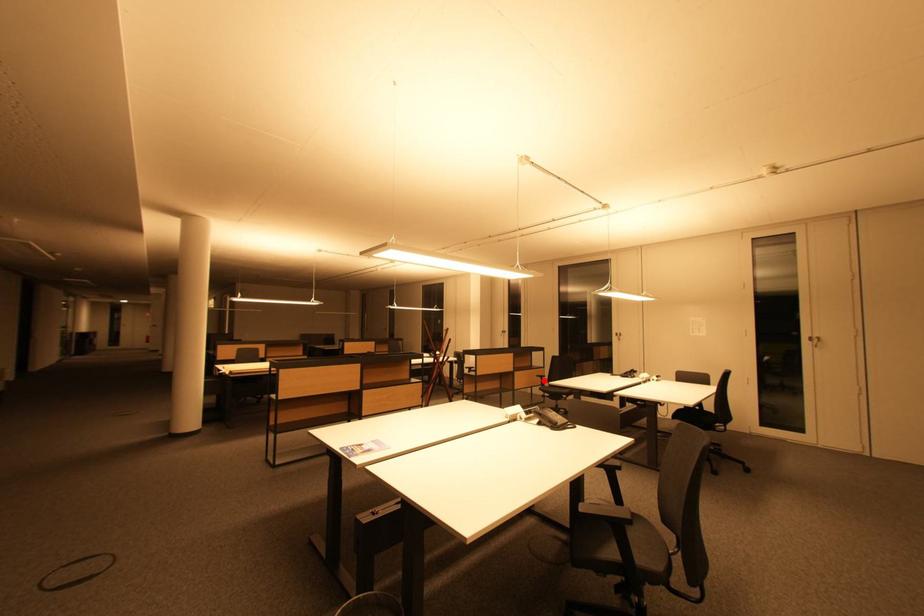
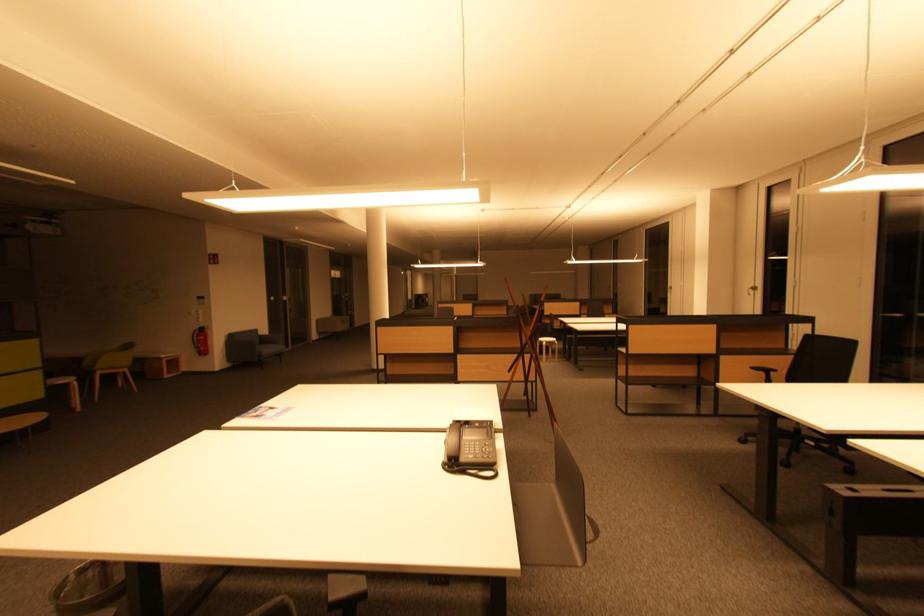
Where in the second image is the point corresponding to the highlighted location from the first image?

(767, 376)